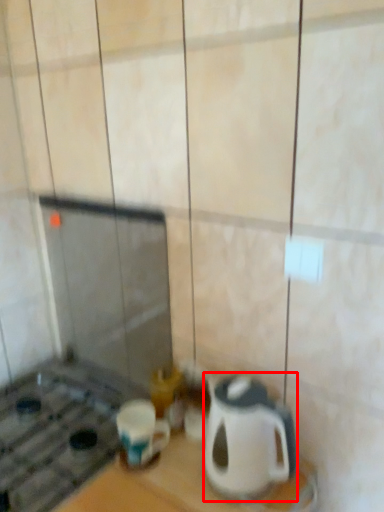
Question: Where is kitchen appliance (annotated by the red box) located in relation to coffee cup in the image?

Choices:
 (A) right
 (B) left

Answer: (A)